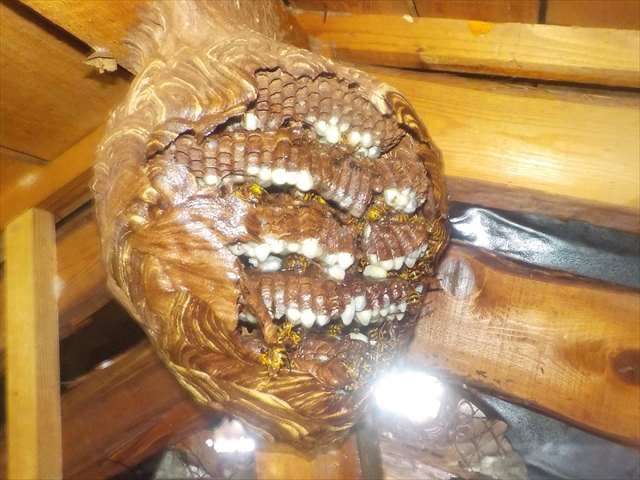
Where is `support beams`? support beams is located at coordinates (532, 172), (35, 388), (291, 468).